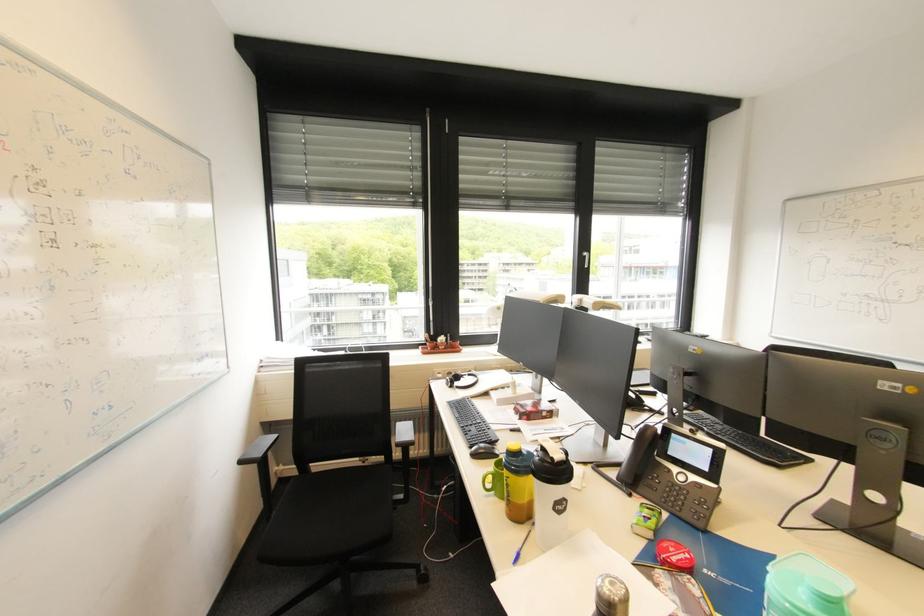
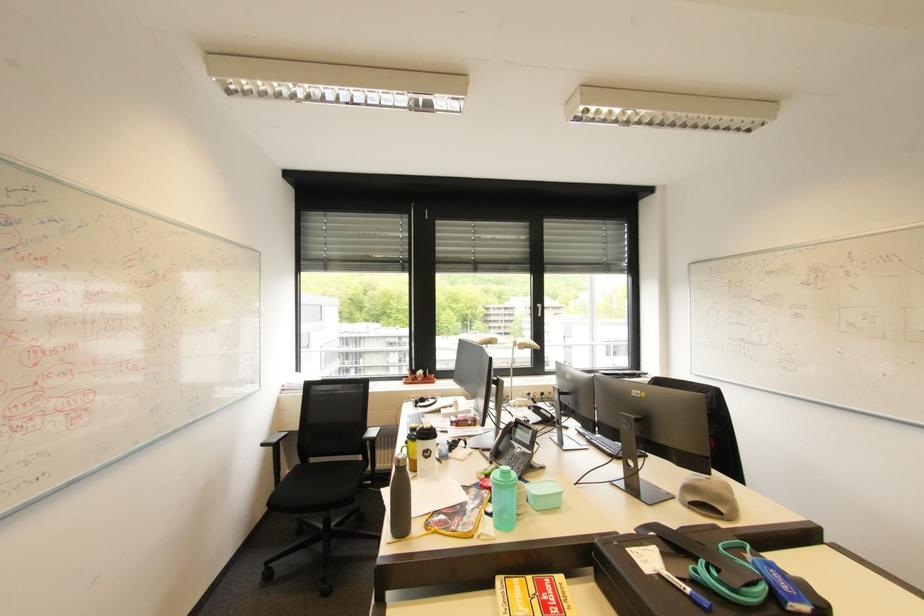
Which direction would the cameraman need to move to produce the second image?

The cameraman moved toward right, backward.